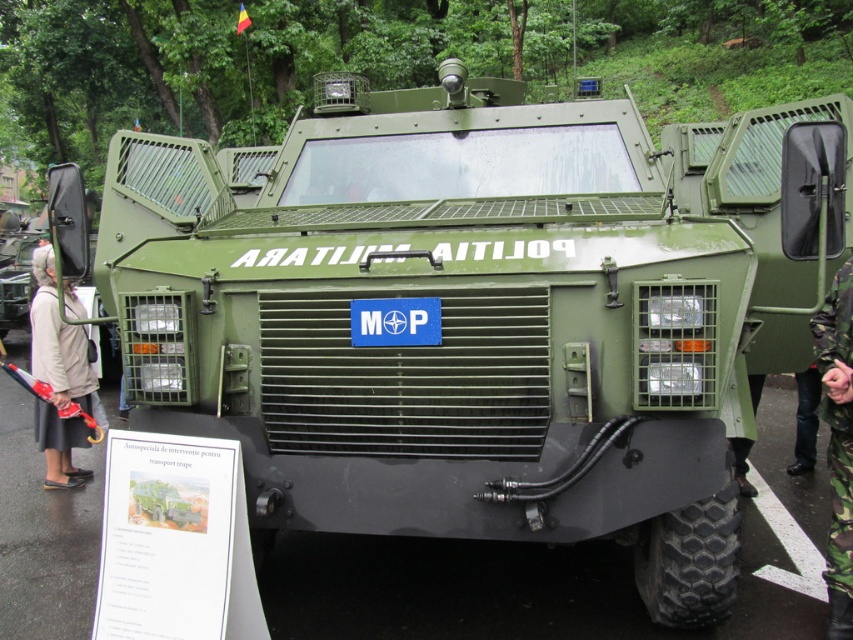
You are an observer standing in front of the military vehicle. You notice two items near the front of the vehicle. One is a beige fabric coat at left and the other is a camouflage fabric uniform at right. Which item appears taller when viewed from your position?

The beige fabric coat at left appears much taller than the camouflage fabric uniform at right when viewed from your position.

You are a military officer who needs to choose between the beige fabric coat at left and the camouflage fabric uniform at right for an outdoor mission. Based on their positions in the image, which item is more accessible to you?

The beige fabric coat at left is positioned over the camouflage fabric uniform at right, so it is more accessible as it is placed on top.

You are a tailor assessing clothing items in a storage room. You see a beige fabric coat at left and a camouflage fabric uniform at right. Which item has a greater width?

The beige fabric coat at left has a greater width than the camouflage fabric uniform at right.